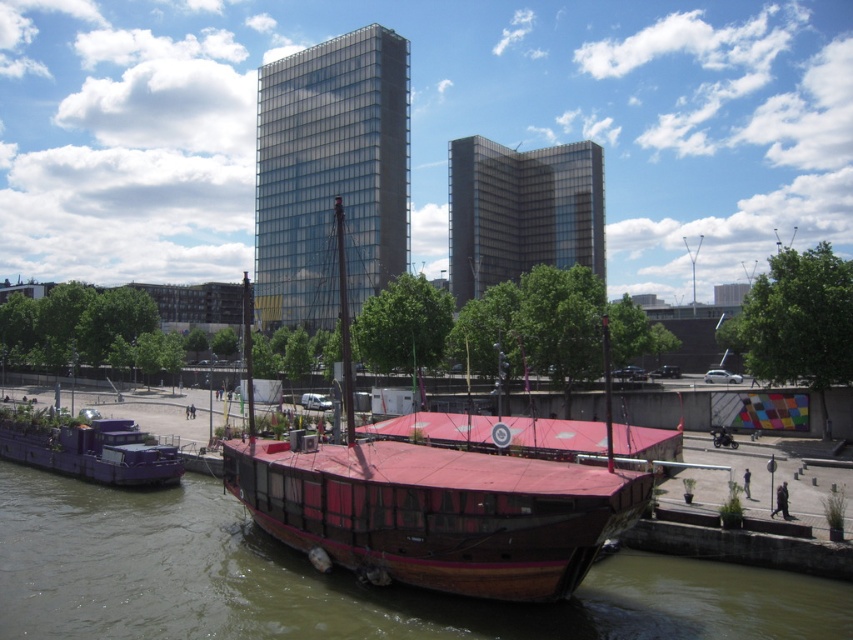
You are a tour guide explaining the location of the brown wooden boat at center to a visitor. Based on the coordinates provided, can you describe its position relative to the edges of the image?

The brown wooden boat at center is located at coordinates point (334, 580), which means it is positioned closer to the right edge and slightly below the top edge of the image.

You are a tourist standing on the concrete embankment in the midground. You see the brown wooden boat at center and the purple matte houseboat at lower left. Which boat is closer to your right side?

The brown wooden boat at center is to the right of the purple matte houseboat at lower left, so it is closer to your right side.

You are standing on the concrete embankment in the midground of the urban riverside scene. You notice two points marked on the image, point 1 at coordinates point (381, 609) and point 2 at coordinates point (131, 456). Which point is closer to you?

Point (381, 609) is in front of point (131, 456), so point (381, 609) is closer to you.